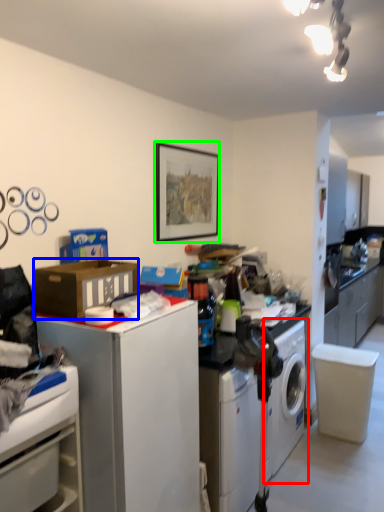
Question: Based on their relative distances, which object is farther from washing machine (highlighted by a red box)? Choose from cardboard box (highlighted by a blue box) and picture frame (highlighted by a green box).

Choices:
 (A) cardboard box
 (B) picture frame

Answer: (A)